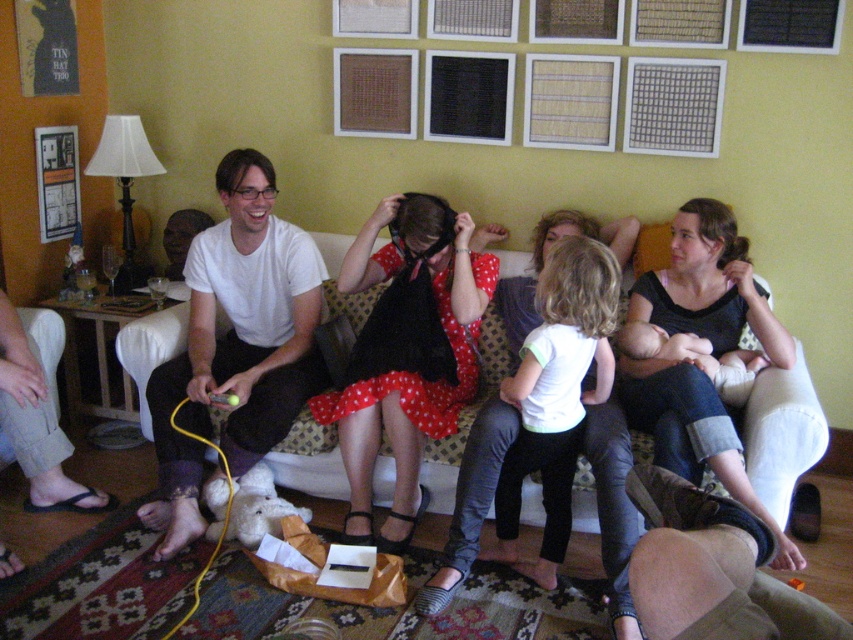
You are organizing a photo shoot in the living room. You have a white matte shirt at center and a brown leather couch at lower right. Which object takes up more space in the image?

The white matte shirt at center takes up more space in the image because it is bigger than the brown leather couch at lower right.

Based on the coordinates provided, which object is located at point [236,342]?

The point [236,342] corresponds to the white matte shirt at left.